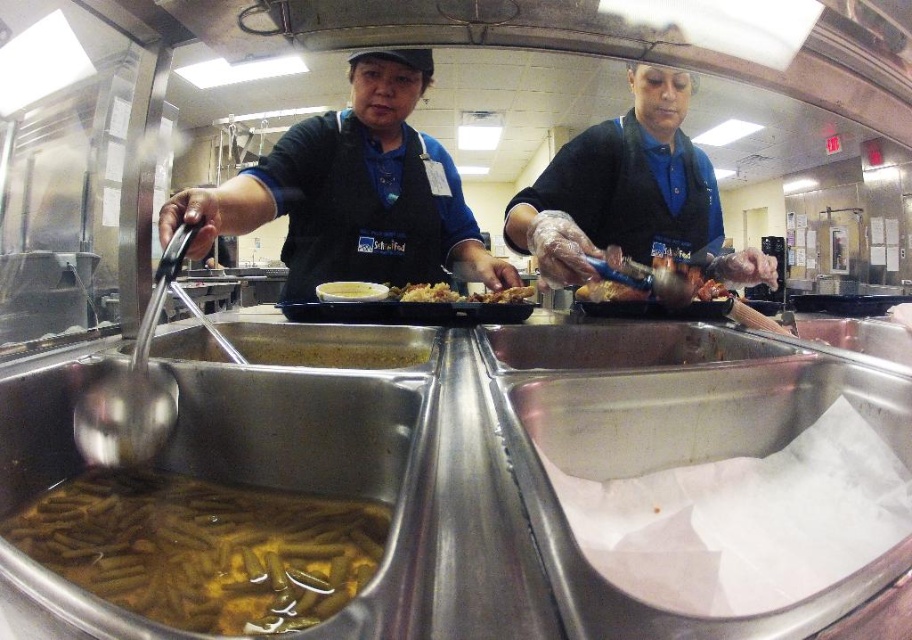
What do you see at coordinates (659, 276) in the screenshot?
I see `shiny brown meat at center` at bounding box center [659, 276].

Is shiny brown meat at center above golden crispy chicken at center?

Indeed, shiny brown meat at center is positioned over golden crispy chicken at center.

Between point (643, 273) and point (420, 291), which one is positioned in front?

Point (643, 273) is more forward.

At what (x,y) coordinates should I click in order to perform the action: click on shiny brown meat at center. Please return your answer as a coordinate pair (x, y). The image size is (912, 640). Looking at the image, I should click on (659, 276).

Is blue fabric apron at center taller than golden crispy chicken at center?

Yes.

How distant is blue fabric apron at center from golden crispy chicken at center?

The distance of blue fabric apron at center from golden crispy chicken at center is 9.54 inches.

Does point (403, 104) come closer to viewer compared to point (434, 291)?

No.

Where is `blue fabric apron at center`? The width and height of the screenshot is (912, 640). blue fabric apron at center is located at coordinates (351, 193).

Is point (359, 586) positioned after point (429, 221)?

That is False.

Does point (229, 593) come closer to viewer compared to point (232, 192)?

That is True.

Measure the distance between point (99, 525) and camera.

Point (99, 525) and camera are 48.63 centimeters apart.

Where is `green matte beans at lower left`? The height and width of the screenshot is (640, 912). green matte beans at lower left is located at coordinates (203, 548).